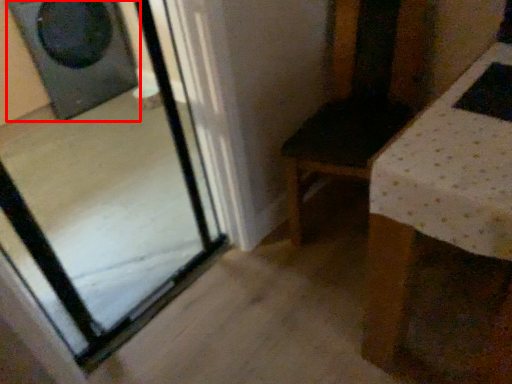
Question: Observing the image, what is the correct spatial positioning of speaker (annotated by the red box) in reference to glass door?

Choices:
 (A) right
 (B) left

Answer: (B)